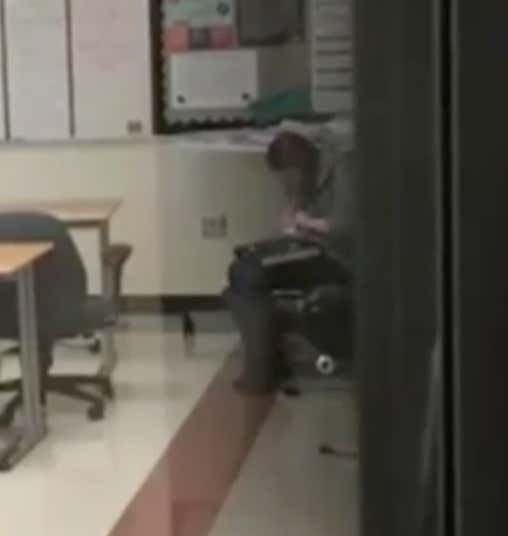
The height and width of the screenshot is (536, 508). I want to click on board, so point(103,70), point(256,92).